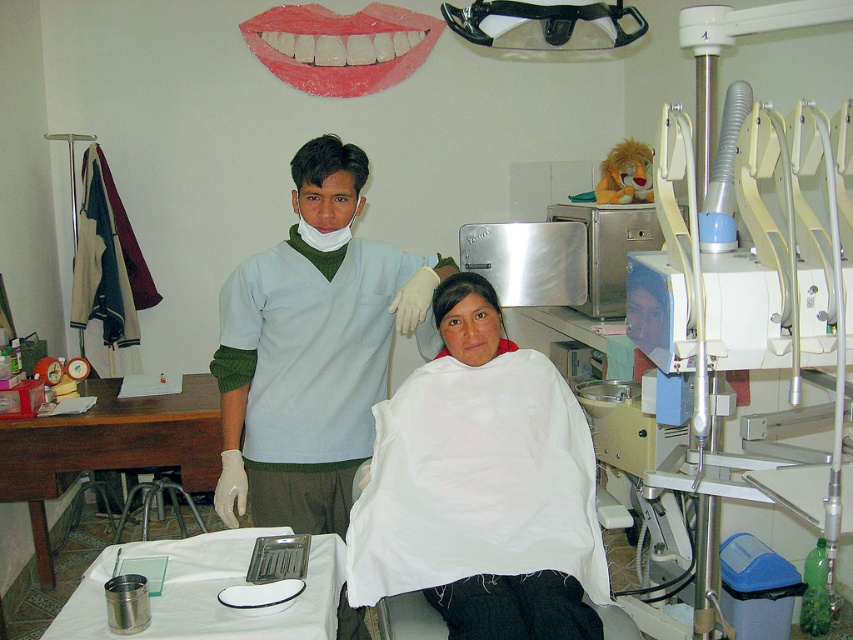
Question: Does light blue scrubs at center appear on the right side of pink matte lips at upper center?

Choices:
 (A) no
 (B) yes

Answer: (A)

Question: Which of the following is the farthest from the observer?

Choices:
 (A) (461, 289)
 (B) (283, 76)

Answer: (B)

Question: Does light blue scrubs at center have a smaller size compared to pink matte lips at upper center?

Choices:
 (A) yes
 (B) no

Answer: (B)

Question: Can you confirm if brushed metal tray at lower left is positioned to the right of pink matte lips at upper center?

Choices:
 (A) no
 (B) yes

Answer: (A)

Question: Which point is farther to the camera?

Choices:
 (A) white matte hair at center
 (B) light blue scrubs at center
 (C) pink matte lips at upper center

Answer: (A)

Question: Which point is closer to the camera?

Choices:
 (A) [376, 253]
 (B) [469, 556]

Answer: (B)